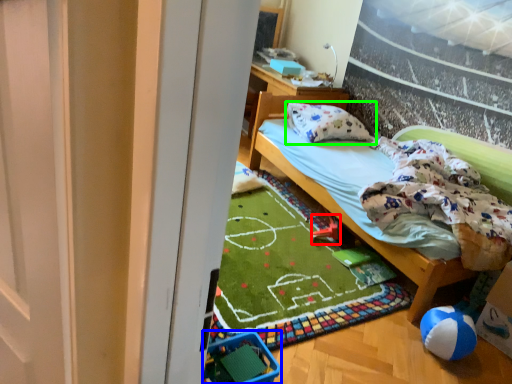
Question: Estimate the real-world distances between objects in this image. Which object is closer to toy (highlighted by a red box), baby carriage (highlighted by a blue box) or pillow (highlighted by a green box)?

Choices:
 (A) baby carriage
 (B) pillow

Answer: (B)